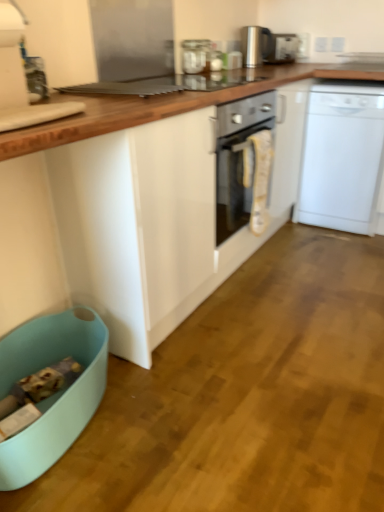
Locate an element on the screen. vacant area situated below white glossy cabinet at center (from a real-world perspective) is located at coordinates (266, 331).